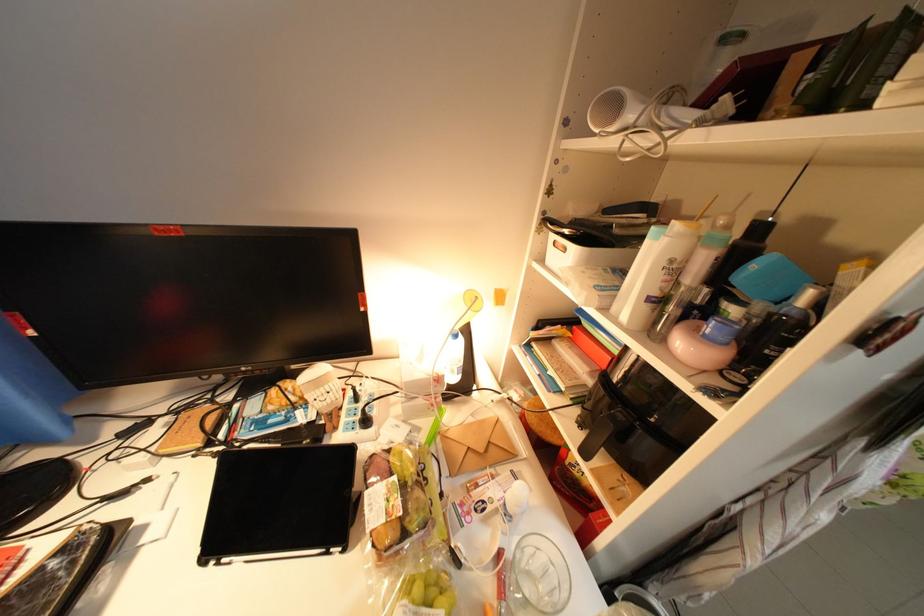
Image resolution: width=924 pixels, height=616 pixels. Describe the element at coordinates (472, 300) in the screenshot. I see `a yellow lamp head` at that location.